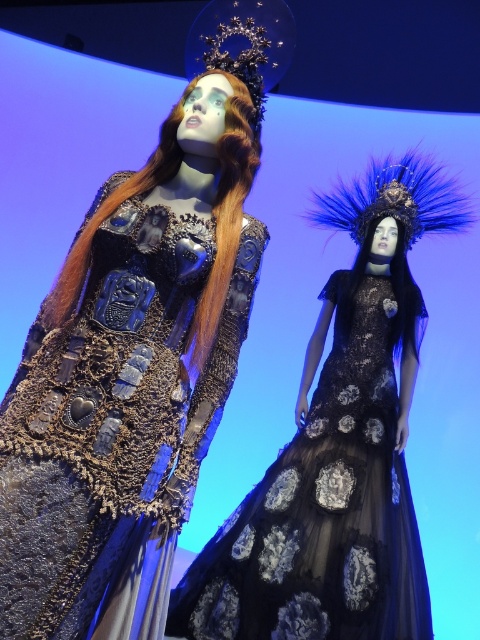
You are a photographer setting up a shoot in front of a blue backdrop. You have two mannequins wearing a shiny metallic dress at center and a black tulle dress at center. The client wants the shiny metallic dress to be the focal point. Based on the scene description, which dress should you position closer to the camera to achieve this?

The shiny metallic dress at center is already positioned in front of the black tulle dress at center, so keeping it closer to the camera will naturally make it the focal point as desired.

You are an interior designer planning to place a new sofa in a room. The sofa must be positioned so that it faces the shiny metallic dress at center. Given that the sofa will be placed at coordinates approximately between 0.5 and 0.7 on the x and y axes, will the sofa be facing the correct direction to view the dress?

The shiny metallic dress at center is located at point (116, 428). Since the sofa is placed between 0.5 and 0.7 on both axes, its position would be within that range, meaning it would be facing the correct direction to view the dress.

You are a fashion designer trying to fit both the shiny metallic dress at center and the black tulle dress at center into a display case that can only accommodate items up to the width of the wider dress. Which dress should you use as the reference for the case size?

The black tulle dress at center is wider than the shiny metallic dress at center, so you should use the black tulle dress at center as the reference for the display case size to ensure both dresses fit.